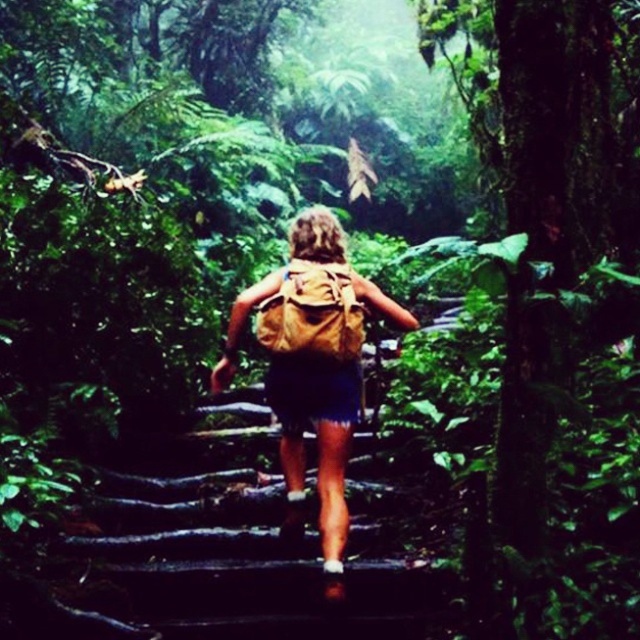
Is brown fabric backpack at center to the left of brown canvas backpack at center from the viewer's perspective?

Correct, you'll find brown fabric backpack at center to the left of brown canvas backpack at center.

The width and height of the screenshot is (640, 640). Describe the element at coordinates (316, 433) in the screenshot. I see `brown fabric backpack at center` at that location.

The height and width of the screenshot is (640, 640). Find the location of `brown fabric backpack at center`. brown fabric backpack at center is located at coordinates (316, 433).

Where is `wooden steps at center`? wooden steps at center is located at coordinates (230, 560).

Is wooden steps at center wider than brown fabric backpack at center?

Correct, the width of wooden steps at center exceeds that of brown fabric backpack at center.

Between point (349, 616) and point (353, 376), which one is positioned in front?

Point (349, 616) is more forward.

In order to click on wooden steps at center in this screenshot , I will do `click(230, 560)`.

Does wooden steps at center have a greater height compared to brown canvas backpack at center?

No.

Is wooden steps at center positioned in front of brown canvas backpack at center?

Yes.

Find the location of a particular element. Image resolution: width=640 pixels, height=640 pixels. wooden steps at center is located at coordinates (230, 560).